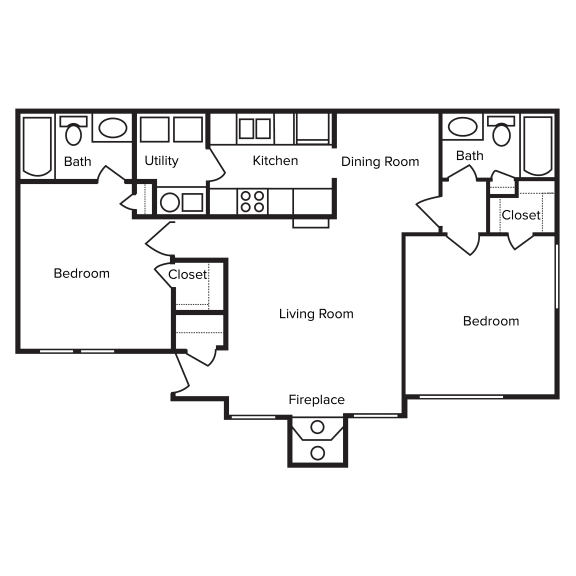
The width and height of the screenshot is (576, 576). I want to click on kitchen, so click(x=271, y=172).